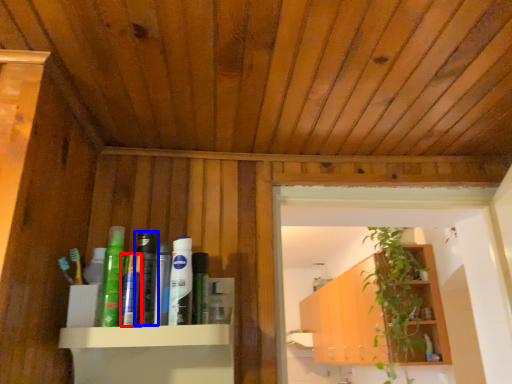
Question: Which object appears closest to the camera in this image, toothpaste (highlighted by a red box) or toiletry (highlighted by a blue box)?

Choices:
 (A) toothpaste
 (B) toiletry

Answer: (A)